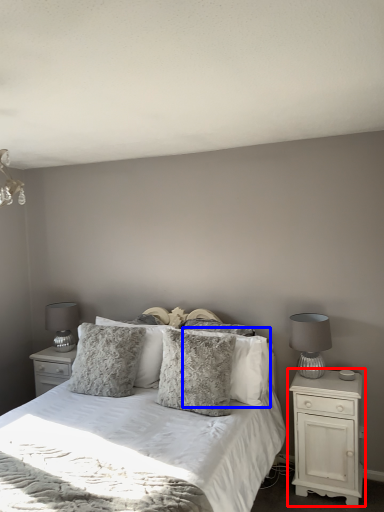
Question: Which of the following is the closest to the observer, nightstand (highlighted by a red box) or pillow (highlighted by a blue box)?

Choices:
 (A) nightstand
 (B) pillow

Answer: (A)